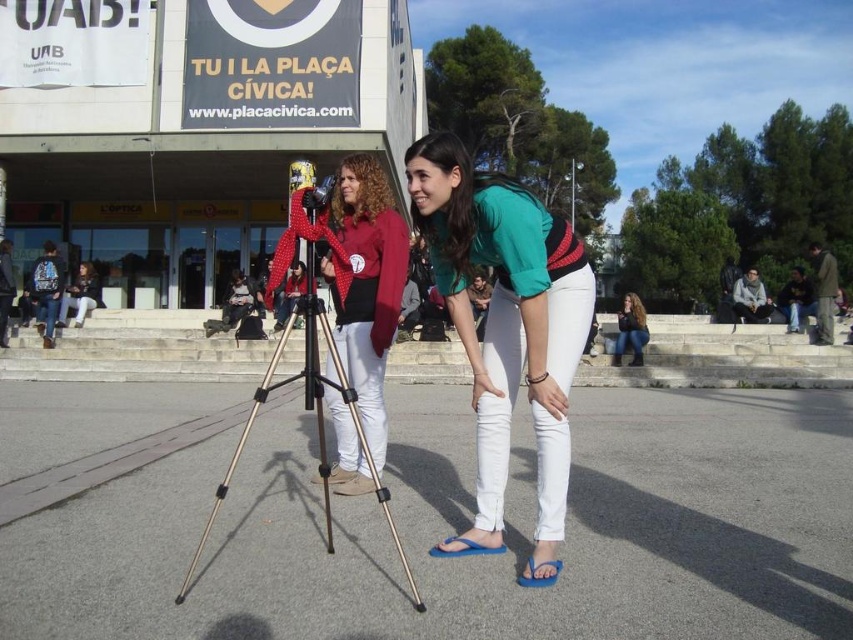
Between matte red shirt at center and matte black jacket at lower left, which one is positioned lower?

Positioned lower is matte black jacket at lower left.

Which is behind, point (392, 273) or point (80, 310)?

Positioned behind is point (80, 310).

Is point (358, 170) behind point (94, 280)?

No, (358, 170) is in front of (94, 280).

This screenshot has height=640, width=853. I want to click on matte red shirt at center, so click(x=368, y=285).

Is matte red shirt at center to the left of black metallic tripod at center from the viewer's perspective?

Incorrect, matte red shirt at center is not on the left side of black metallic tripod at center.

Between point (352, 332) and point (335, 285), which one is positioned in front?

Point (352, 332) is in front.

The width and height of the screenshot is (853, 640). What are the coordinates of `matte red shirt at center` in the screenshot? It's located at (368, 285).

Looking at this image, who is more distant from viewer, (643, 314) or (57, 321)?

The point (57, 321) is more distant.

Does point (616, 339) come farther from viewer compared to point (80, 285)?

No, (616, 339) is in front of (80, 285).

Locate an element on the screen. The width and height of the screenshot is (853, 640). jeans at lower right is located at coordinates (630, 330).